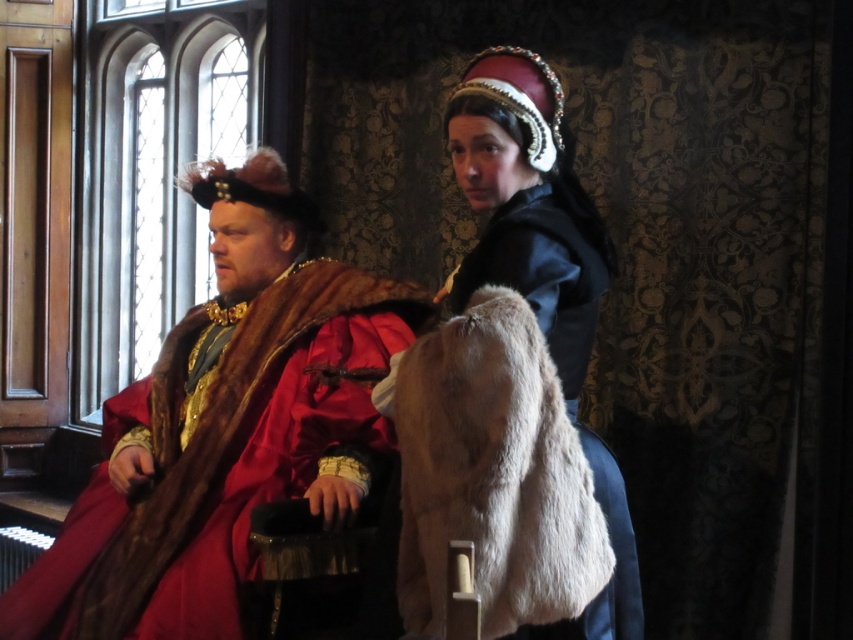
Does velvet red robe at left have a lesser width compared to velvet black dress at center?

Incorrect, velvet red robe at left's width is not less than velvet black dress at center's.

You are a GUI agent. You are given a task and a screenshot of the screen. Output one action in this format:
    pyautogui.click(x=<x>, y=<y>)
    Task: Click on the velvet red robe at left
    The height and width of the screenshot is (640, 853).
    Given the screenshot: What is the action you would take?
    click(x=225, y=426)

Describe the element at coordinates (225, 426) in the screenshot. I see `velvet red robe at left` at that location.

This screenshot has width=853, height=640. Find the location of `velvet red robe at left`. velvet red robe at left is located at coordinates (225, 426).